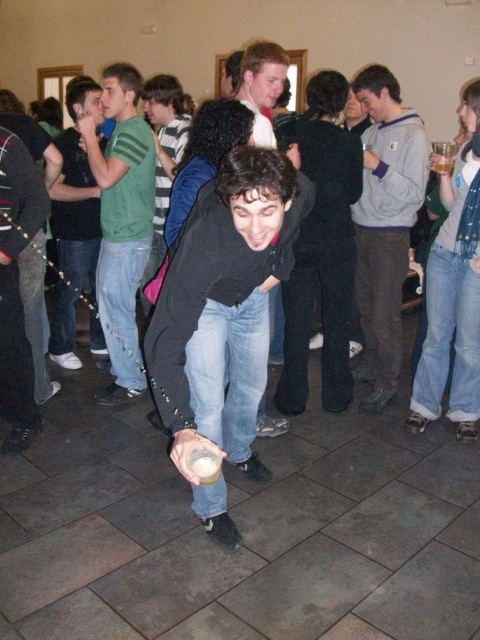
Question: Which point is farther to the camera?

Choices:
 (A) gray fleece sweater at center
 (B) matte black shirt at upper left

Answer: (B)

Question: Is green striped shirt at upper left behind matte black shirt at upper left?

Choices:
 (A) yes
 (B) no

Answer: (B)

Question: Which of these objects is positioned farthest from the matte black jacket at center?

Choices:
 (A) black matte jacket at center
 (B) gray fleece sweater at center
 (C) matte black shirt at upper left
 (D) green striped shirt at upper left

Answer: (C)

Question: Which point appears closest to the camera in this image?

Choices:
 (A) (109, 115)
 (B) (73, 93)

Answer: (A)

Question: Does gray fleece sweater at center appear under green striped shirt at upper left?

Choices:
 (A) yes
 (B) no

Answer: (B)

Question: Does black matte jacket at center have a larger size compared to gray fleece sweater at center?

Choices:
 (A) yes
 (B) no

Answer: (A)